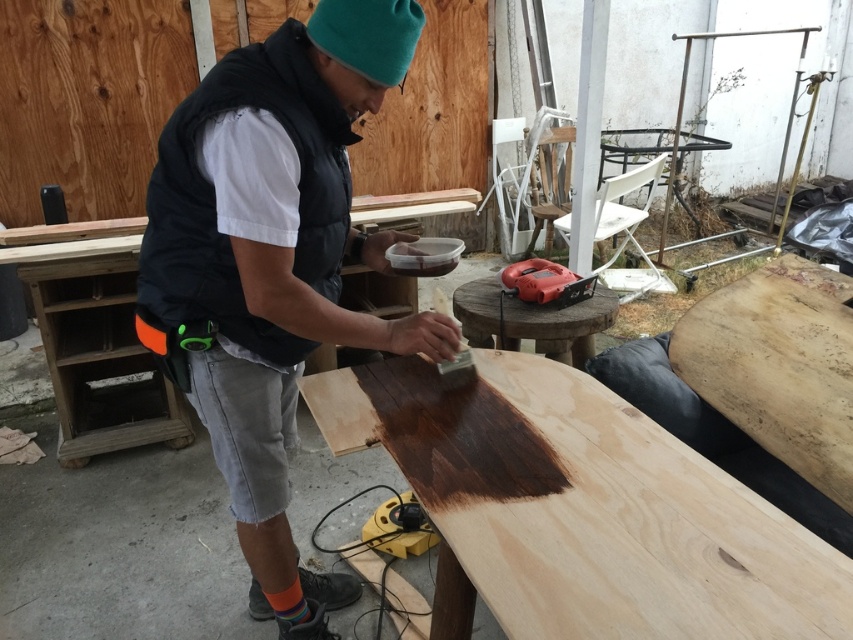
Who is taller, matte black vest at center or natural wood plywood at lower right?

With more height is matte black vest at center.

Does matte black vest at center have a greater width compared to natural wood plywood at lower right?

Yes.

Does point (408, 24) lie in front of point (799, 464)?

Yes, it is in front of point (799, 464).

Locate an element on the screen. The width and height of the screenshot is (853, 640). matte black vest at center is located at coordinates (271, 264).

Which is below, dark stained wood at center or natural wood plywood at lower right?

dark stained wood at center is below.

Is point (345, 392) positioned in front of point (828, 301)?

Yes, it is.

Locate an element on the screen. Image resolution: width=853 pixels, height=640 pixels. dark stained wood at center is located at coordinates (579, 509).

Between natural wood plywood at lower right and orange plastic power tool at center, which one has more height?

natural wood plywood at lower right

Does point (711, 365) lie behind point (521, 275)?

No, (711, 365) is in front of (521, 275).

Locate an element on the screen. natural wood plywood at lower right is located at coordinates (778, 365).